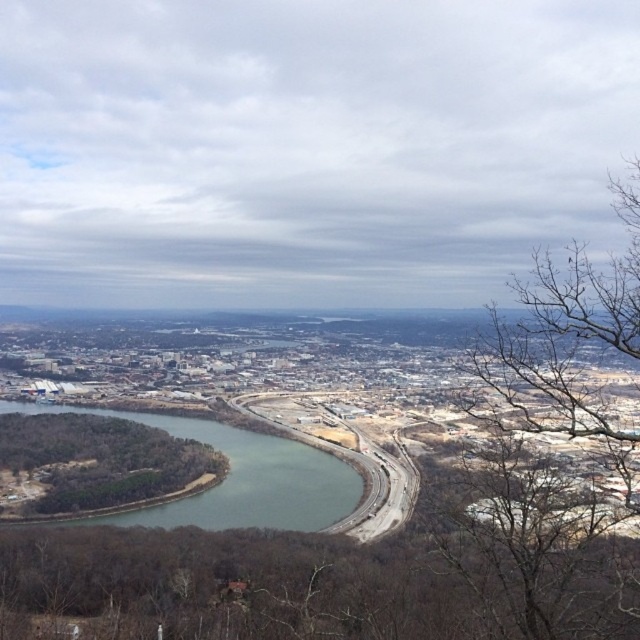
Question: From the image, what is the correct spatial relationship of green leafy tree at lower left in relation to green water at center?

Choices:
 (A) left
 (B) right

Answer: (A)

Question: Does green leafy tree at lower left appear on the left side of green water at center?

Choices:
 (A) no
 (B) yes

Answer: (B)

Question: Which of the following is the farthest from the observer?

Choices:
 (A) (300, 522)
 (B) (88, 470)

Answer: (B)

Question: Does green leafy tree at lower left have a smaller size compared to green water at center?

Choices:
 (A) no
 (B) yes

Answer: (B)

Question: Which point is closer to the camera taking this photo?

Choices:
 (A) coord(188,484)
 (B) coord(353,490)

Answer: (B)